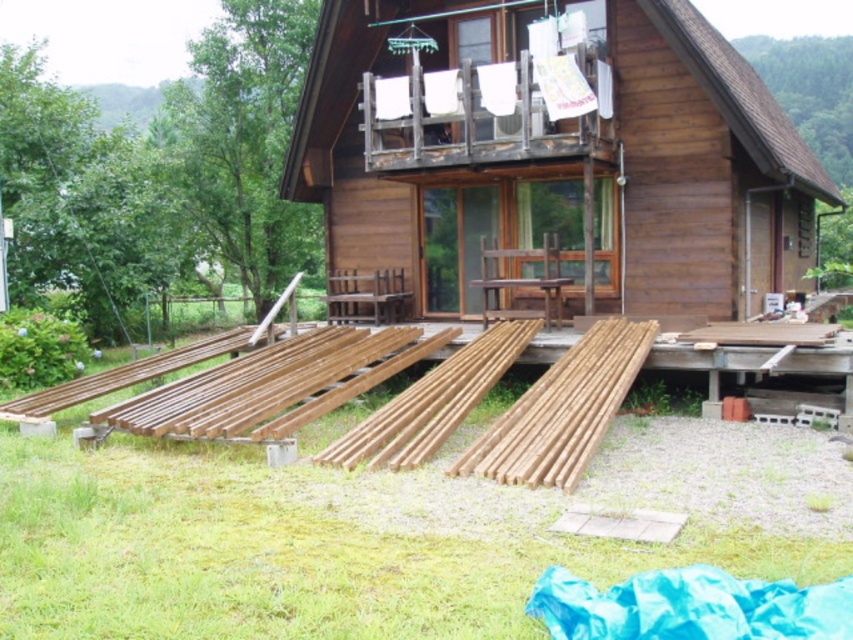
Locate an element on the screen. This screenshot has height=640, width=853. wooden cabin at center is located at coordinates (553, 154).

Is wooden cabin at center closer to camera compared to natural wood planks at lower center?

No, it is not.

Describe the element at coordinates (553, 154) in the screenshot. I see `wooden cabin at center` at that location.

The height and width of the screenshot is (640, 853). I want to click on wooden cabin at center, so click(553, 154).